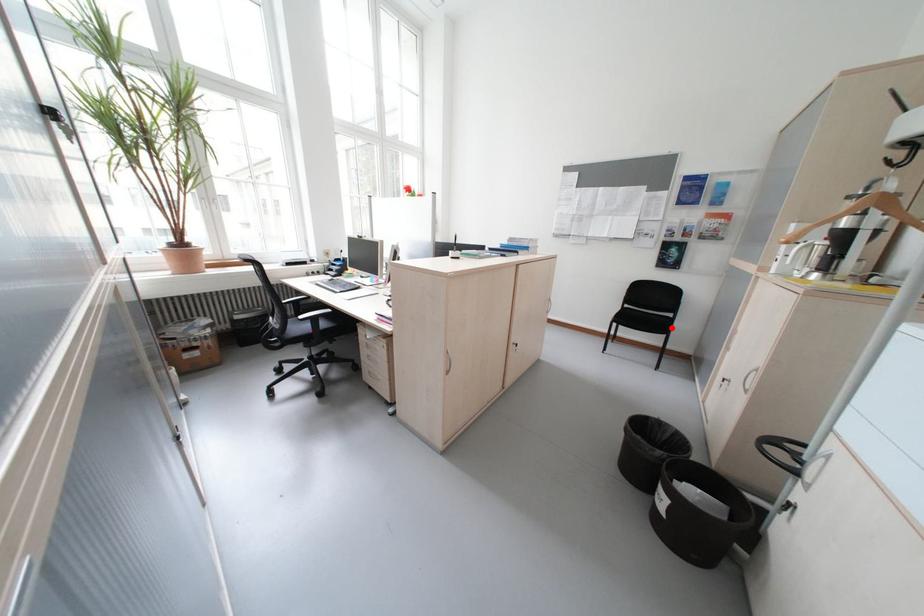
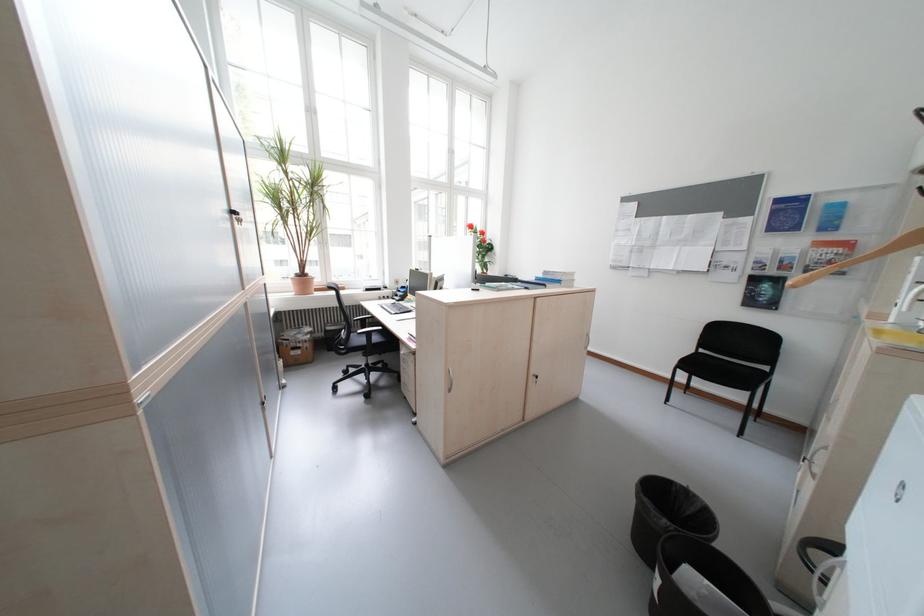
The point at the highlighted location is marked in the first image. Where is the corresponding point in the second image?

(758, 382)